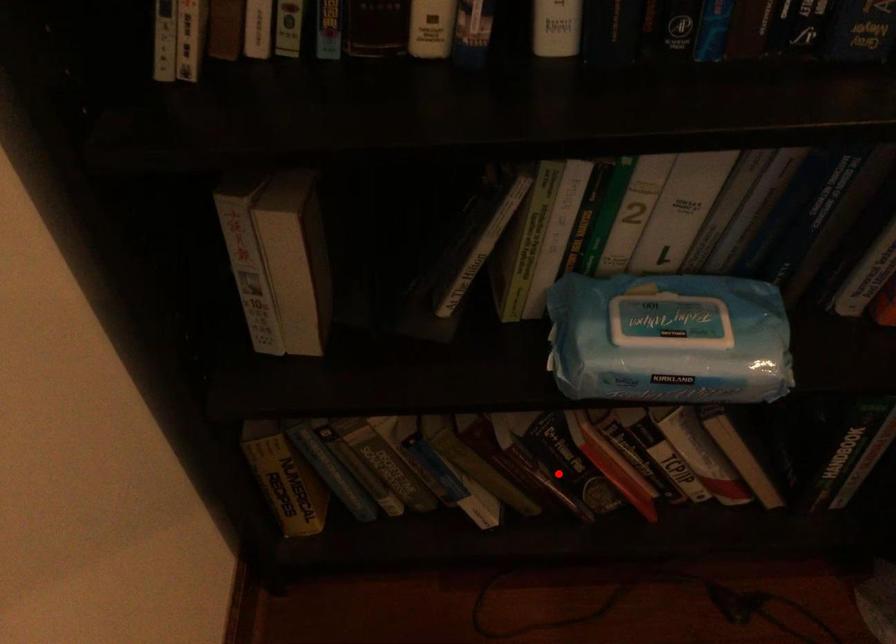
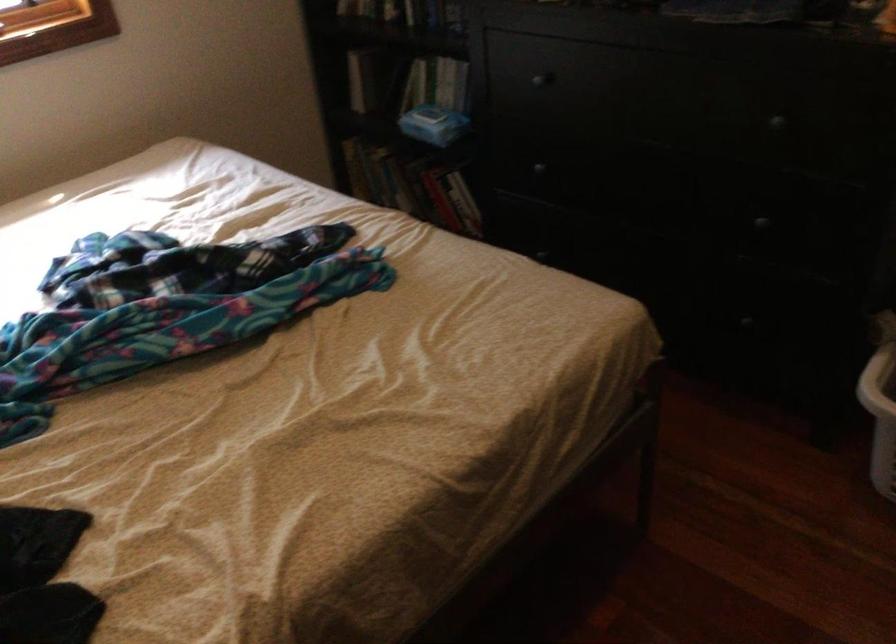
The point at the highlighted location is marked in the first image. Where is the corresponding point in the second image?

(418, 187)